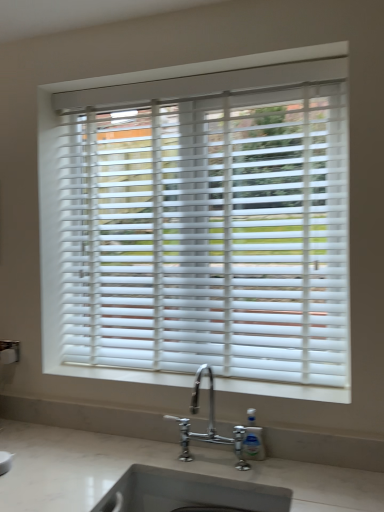
Question: Is white matte window sill at center positioned far away from clear plastic soap dispenser at lower center?

Choices:
 (A) yes
 (B) no

Answer: (B)

Question: Considering the relative sizes of white matte window sill at center and clear plastic soap dispenser at lower center in the image provided, is white matte window sill at center smaller than clear plastic soap dispenser at lower center?

Choices:
 (A) yes
 (B) no

Answer: (B)

Question: From the image's perspective, is white matte window sill at center above clear plastic soap dispenser at lower center?

Choices:
 (A) yes
 (B) no

Answer: (A)

Question: Is clear plastic soap dispenser at lower center at the back of white matte window sill at center?

Choices:
 (A) yes
 (B) no

Answer: (B)

Question: From a real-world perspective, is white matte window sill at center located higher than clear plastic soap dispenser at lower center?

Choices:
 (A) no
 (B) yes

Answer: (B)

Question: Looking at the image, does white matte window sill at center seem bigger or smaller compared to clear plastic soap dispenser at lower center?

Choices:
 (A) small
 (B) big

Answer: (B)

Question: In the image, is white matte window sill at center on the left side or the right side of clear plastic soap dispenser at lower center?

Choices:
 (A) left
 (B) right

Answer: (A)

Question: From their relative heights in the image, would you say white matte window sill at center is taller or shorter than clear plastic soap dispenser at lower center?

Choices:
 (A) tall
 (B) short

Answer: (B)

Question: From the image's perspective, is white matte window sill at center positioned above or below clear plastic soap dispenser at lower center?

Choices:
 (A) above
 (B) below

Answer: (A)

Question: Considering the positions of point (253, 100) and point (140, 485), is point (253, 100) closer or farther from the camera than point (140, 485)?

Choices:
 (A) closer
 (B) farther

Answer: (B)

Question: In terms of size, does white matte blinds at center appear bigger or smaller than white marble sink at lower center?

Choices:
 (A) big
 (B) small

Answer: (A)

Question: Is white matte blinds at center inside the boundaries of white marble sink at lower center, or outside?

Choices:
 (A) inside
 (B) outside

Answer: (B)

Question: From a real-world perspective, relative to white marble sink at lower center, is white matte blinds at center vertically above or below?

Choices:
 (A) below
 (B) above

Answer: (B)

Question: Looking at the image, does white matte window sill at center seem bigger or smaller compared to white matte blinds at center?

Choices:
 (A) big
 (B) small

Answer: (B)

Question: Is white matte window sill at center to the left or to the right of white matte blinds at center in the image?

Choices:
 (A) left
 (B) right

Answer: (A)